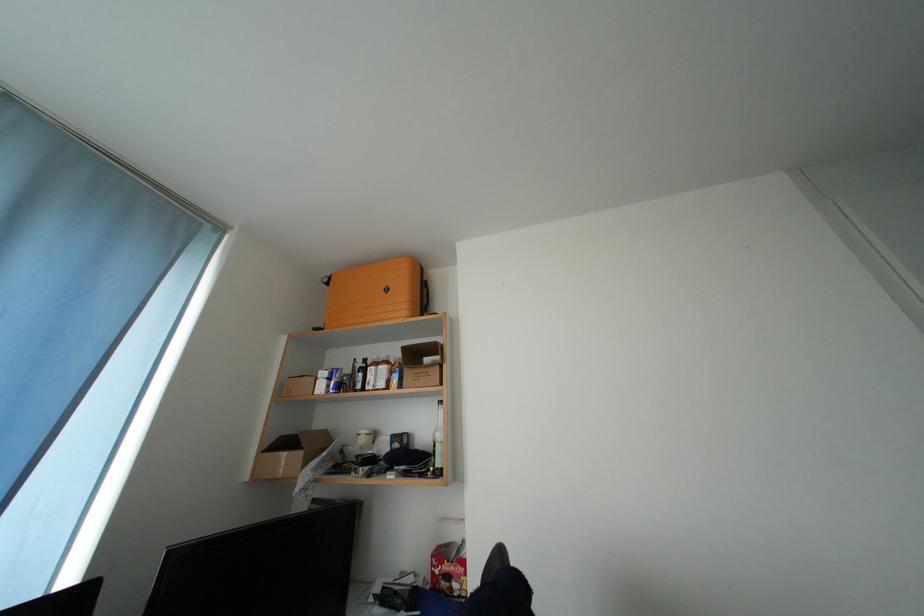
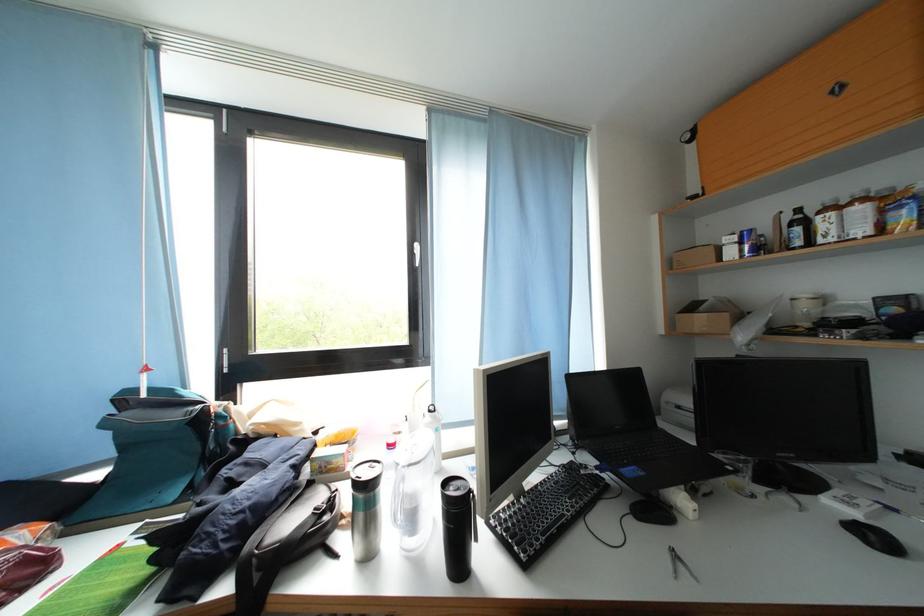
The point at (372, 375) is marked in the first image. Where is the corresponding point in the second image?

(812, 227)